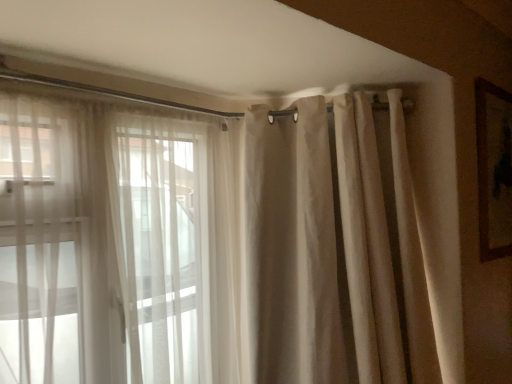
What is the approximate width of sheer white curtains at left?

The width of sheer white curtains at left is 10.24 centimeters.

Measure the distance between point [489,111] and camera.

Point [489,111] is 1.62 meters from camera.

Where is `beige fabric curtain at upper right`? Image resolution: width=512 pixels, height=384 pixels. beige fabric curtain at upper right is located at coordinates (292, 247).

Is beige fabric curtain at upper right placed right next to brown wooden picture frame at upper right?

No, beige fabric curtain at upper right is not next to brown wooden picture frame at upper right.

Is beige fabric curtain at upper right facing away from brown wooden picture frame at upper right?

That's not correct — beige fabric curtain at upper right is not looking away from brown wooden picture frame at upper right.

Which of these two, beige fabric curtain at upper right or brown wooden picture frame at upper right, stands taller?

With more height is beige fabric curtain at upper right.

In the scene shown: From the image's perspective, is beige fabric curtain at upper right located above or below brown wooden picture frame at upper right?

beige fabric curtain at upper right is below brown wooden picture frame at upper right.

Where is `picture frame above the sheer white curtains at left (from the image's perspective)`? This screenshot has height=384, width=512. picture frame above the sheer white curtains at left (from the image's perspective) is located at coordinates (494, 169).

Can you confirm if sheer white curtains at left is thinner than brown wooden picture frame at upper right?

In fact, sheer white curtains at left might be wider than brown wooden picture frame at upper right.

Is sheer white curtains at left in front of brown wooden picture frame at upper right?

Yes, it is in front of brown wooden picture frame at upper right.

Considering the positions of points (155, 326) and (481, 102), is point (155, 326) closer to camera compared to point (481, 102)?

That is True.

Considering the positions of points (383, 291) and (64, 168), is point (383, 291) closer to camera compared to point (64, 168)?

That is False.

From the image's perspective, which object appears higher, beige fabric curtain at upper right or sheer white curtains at left?

beige fabric curtain at upper right appears higher in the image.

Considering their positions, is beige fabric curtain at upper right located in front of or behind sheer white curtains at left?

beige fabric curtain at upper right is behind sheer white curtains at left.

Considering the sizes of beige fabric curtain at upper right and sheer white curtains at left in the image, is beige fabric curtain at upper right wider or thinner than sheer white curtains at left?

In the image, beige fabric curtain at upper right appears to be wider than sheer white curtains at left.

Between brown wooden picture frame at upper right and beige fabric curtain at upper right, which one has larger width?

beige fabric curtain at upper right is wider.

How far apart are brown wooden picture frame at upper right and beige fabric curtain at upper right?

brown wooden picture frame at upper right and beige fabric curtain at upper right are 56.03 centimeters apart from each other.

Is brown wooden picture frame at upper right oriented away from beige fabric curtain at upper right?

That's not correct — brown wooden picture frame at upper right is not looking away from beige fabric curtain at upper right.

Is brown wooden picture frame at upper right positioned behind beige fabric curtain at upper right?

Yes, it is.

How distant is sheer white curtains at left from beige fabric curtain at upper right?

They are 17.43 inches apart.

Choose the correct answer: Is sheer white curtains at left inside beige fabric curtain at upper right or outside it?

sheer white curtains at left cannot be found inside beige fabric curtain at upper right.

Does sheer white curtains at left have a smaller size compared to beige fabric curtain at upper right?

Yes.

Based on the photo, is sheer white curtains at left turned away from beige fabric curtain at upper right?

That's not correct — sheer white curtains at left is not looking away from beige fabric curtain at upper right.

From a real-world perspective, is brown wooden picture frame at upper right physically located above or below sheer white curtains at left?

brown wooden picture frame at upper right is above sheer white curtains at left.

The width and height of the screenshot is (512, 384). Identify the location of bay window in front of the brown wooden picture frame at upper right. (101, 244).

Is brown wooden picture frame at upper right further to camera compared to sheer white curtains at left?

Yes, brown wooden picture frame at upper right is further from the camera.

Is brown wooden picture frame at upper right oriented towards sheer white curtains at left?

No.

Locate an element on the screen. picture frame above the beige fabric curtain at upper right (from a real-world perspective) is located at coordinates (494, 169).

Image resolution: width=512 pixels, height=384 pixels. In order to click on bay window located on the left of brown wooden picture frame at upper right in this screenshot , I will do `click(101, 244)`.

From the image, which object appears to be nearer to sheer white curtains at left, beige fabric curtain at upper right or brown wooden picture frame at upper right?

beige fabric curtain at upper right is closer to sheer white curtains at left.

From the image, which object appears to be nearer to sheer white curtains at left, brown wooden picture frame at upper right or beige fabric curtain at upper right?

Based on the image, beige fabric curtain at upper right appears to be nearer to sheer white curtains at left.

Looking at the image, which one is located closer to beige fabric curtain at upper right, brown wooden picture frame at upper right or sheer white curtains at left?

sheer white curtains at left lies closer to beige fabric curtain at upper right than the other object.

Based on the photo, which object lies nearer to the anchor point beige fabric curtain at upper right, sheer white curtains at left or brown wooden picture frame at upper right?

Based on the image, sheer white curtains at left appears to be nearer to beige fabric curtain at upper right.

Estimate the real-world distances between objects in this image. Which object is further from brown wooden picture frame at upper right, beige fabric curtain at upper right or sheer white curtains at left?

Based on the image, sheer white curtains at left appears to be further to brown wooden picture frame at upper right.

Looking at the image, which one is located closer to brown wooden picture frame at upper right, sheer white curtains at left or beige fabric curtain at upper right?

Based on the image, beige fabric curtain at upper right appears to be nearer to brown wooden picture frame at upper right.

I want to click on shower curtain between sheer white curtains at left and brown wooden picture frame at upper right, so click(x=292, y=247).